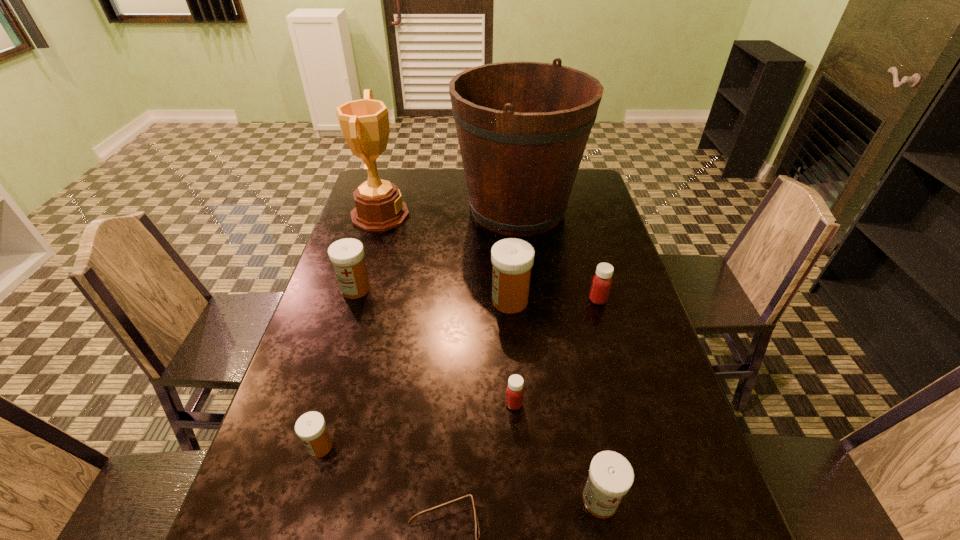
The width and height of the screenshot is (960, 540). Find the location of `vacant space positioned on the back of the fifth farthest medicine`. vacant space positioned on the back of the fifth farthest medicine is located at coordinates (336, 390).

Image resolution: width=960 pixels, height=540 pixels. Find the location of `vacant space located 0.260m on the back of the nearer red medicine`. vacant space located 0.260m on the back of the nearer red medicine is located at coordinates (508, 314).

You are a GUI agent. You are given a task and a screenshot of the screen. Output one action in this format:
    pyautogui.click(x=<x>, y=<y>)
    Task: Click on the bucket located in the far edge section of the desktop
    This screenshot has width=960, height=540.
    Given the screenshot: What is the action you would take?
    pyautogui.click(x=522, y=127)

Identify the location of award that is positioned at the far edge. (364, 123).

You are a GUI agent. You are given a task and a screenshot of the screen. Output one action in this format:
    pyautogui.click(x=<x>, y=<y>)
    Task: Click on the award located at the left edge
    Image resolution: width=960 pixels, height=540 pixels.
    Given the screenshot: What is the action you would take?
    (x=364, y=123)

At what (x,y) coordinates should I click in order to perform the action: click on bucket at the right edge. Please return your answer as a coordinate pair (x, y). This screenshot has width=960, height=540. Looking at the image, I should click on (522, 127).

Locate an element on the screen. Image resolution: width=960 pixels, height=540 pixels. medicine that is at the right edge is located at coordinates (602, 281).

At what (x,y) coordinates should I click in order to perform the action: click on object that is at the far left corner. Please return your answer as a coordinate pair (x, y). The image size is (960, 540). Looking at the image, I should click on (364, 123).

Locate an element on the screen. The image size is (960, 540). object that is positioned at the far right corner is located at coordinates (522, 127).

This screenshot has height=540, width=960. I want to click on free space at the far edge of the desktop, so click(428, 168).